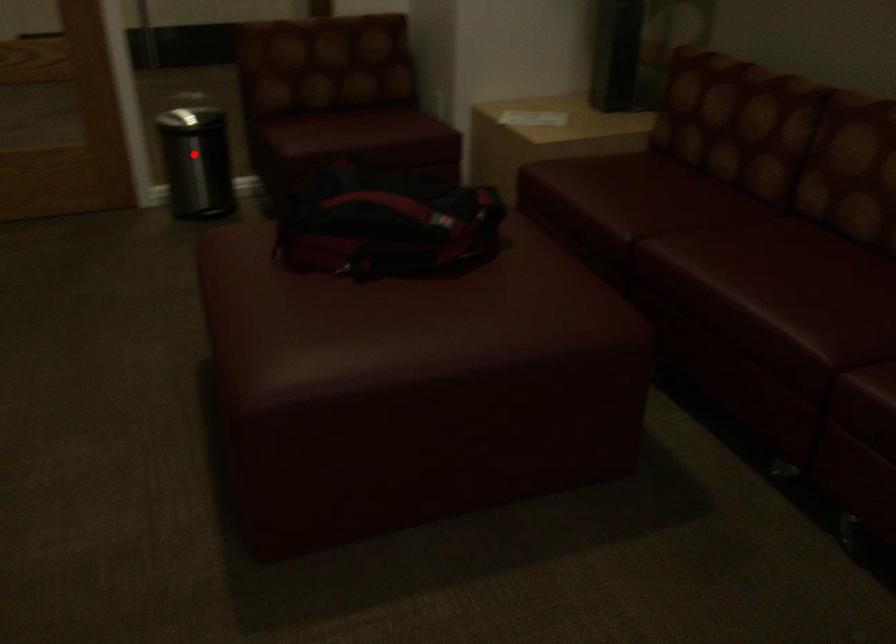
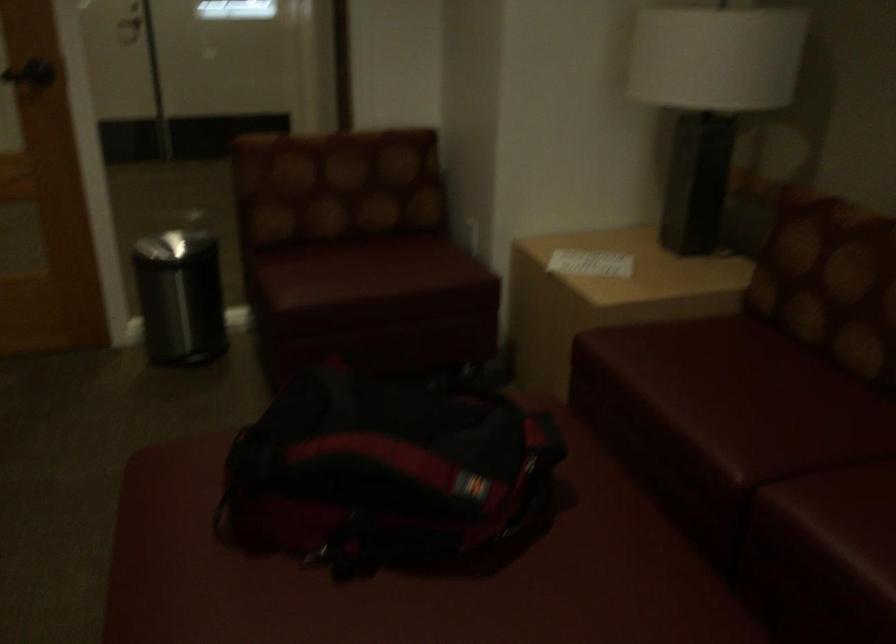
Find the pixel in the second image that matches the highlighted location in the first image.

(179, 297)